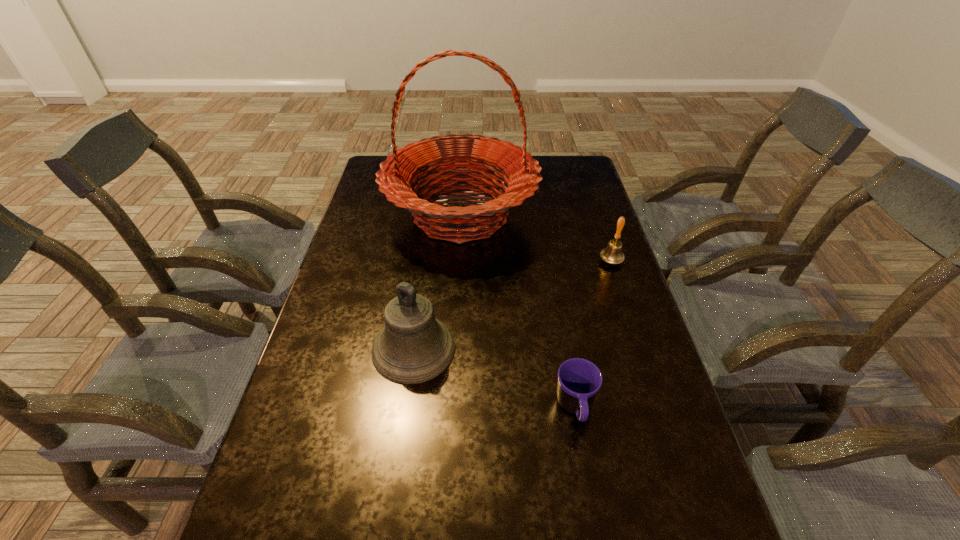
Find the location of a particular element. vacant area that lies between the shortest object and the taller bell is located at coordinates (494, 379).

Identify the location of vacant region between the shortest object and the tallest object. (518, 312).

You are a GUI agent. You are given a task and a screenshot of the screen. Output one action in this format:
    pyautogui.click(x=<x>, y=<y>)
    Task: Click on the free space that is in between the shortest object and the right bell
    
    Given the screenshot: What is the action you would take?
    pyautogui.click(x=593, y=334)

The width and height of the screenshot is (960, 540). I want to click on empty location between the farther bell and the shortest object, so click(x=593, y=334).

Image resolution: width=960 pixels, height=540 pixels. I want to click on free point between the shortest object and the third tallest object, so click(x=593, y=334).

Where is `vacant space in between the second tallest object and the basket`? This screenshot has width=960, height=540. vacant space in between the second tallest object and the basket is located at coordinates (437, 282).

You are a GUI agent. You are given a task and a screenshot of the screen. Output one action in this format:
    pyautogui.click(x=<x>, y=<y>)
    Task: Click on the vacant point located between the mug and the left bell
    The image size is (960, 540).
    Given the screenshot: What is the action you would take?
    pyautogui.click(x=494, y=379)

Image resolution: width=960 pixels, height=540 pixels. Identify the location of vacant space that's between the taller bell and the farther bell. (513, 305).

This screenshot has height=540, width=960. In order to click on free space between the tallest object and the mug in this screenshot , I will do `click(518, 312)`.

Locate which object is the third closest to the shortest object. Please provide its 2D coordinates. Your answer should be formatted as a tuple, i.e. [(x, y)], where the tuple contains the x and y coordinates of a point satisfying the conditions above.

[(612, 254)]